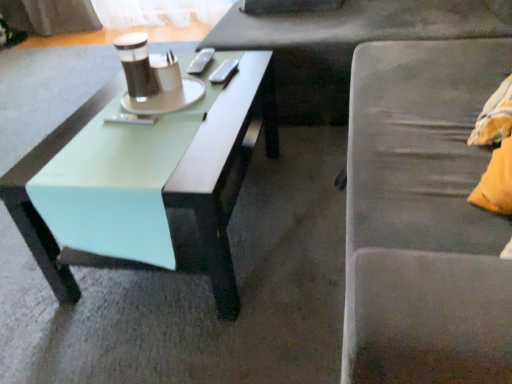
Locate an element on the screen. The height and width of the screenshot is (384, 512). free space between silver metallic remote control at center, which is the second remote control from front to back, and matte black remote control at center, the 1th remote control viewed from the front is located at coordinates (176, 98).